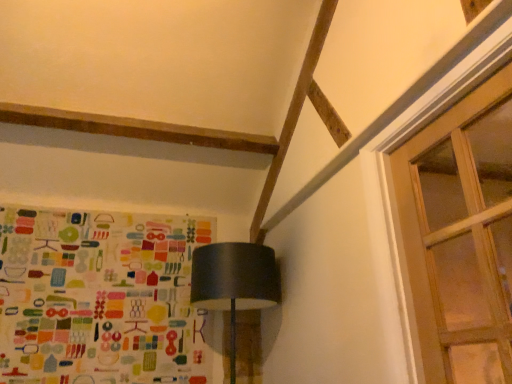
Question: From the image's perspective, would you say clear glass door at upper right is shown under matte black lampshade at center?

Choices:
 (A) no
 (B) yes

Answer: (A)

Question: From the image's perspective, is clear glass door at upper right above matte black lampshade at center?

Choices:
 (A) no
 (B) yes

Answer: (B)

Question: Does clear glass door at upper right come in front of matte black lampshade at center?

Choices:
 (A) yes
 (B) no

Answer: (A)

Question: Could you tell me if clear glass door at upper right is turned towards matte black lampshade at center?

Choices:
 (A) yes
 (B) no

Answer: (B)

Question: Can you confirm if clear glass door at upper right is bigger than matte black lampshade at center?

Choices:
 (A) no
 (B) yes

Answer: (A)

Question: Is clear glass door at upper right far from matte black lampshade at center?

Choices:
 (A) yes
 (B) no

Answer: (A)

Question: Does multicolored fabric at left have a greater height compared to matte black lampshade at center?

Choices:
 (A) no
 (B) yes

Answer: (B)

Question: Is multicolored fabric at left positioned with its back to matte black lampshade at center?

Choices:
 (A) no
 (B) yes

Answer: (A)

Question: From a real-world perspective, is multicolored fabric at left located higher than matte black lampshade at center?

Choices:
 (A) yes
 (B) no

Answer: (A)

Question: From the image's perspective, is multicolored fabric at left located above matte black lampshade at center?

Choices:
 (A) yes
 (B) no

Answer: (A)

Question: Is multicolored fabric at left wider than matte black lampshade at center?

Choices:
 (A) no
 (B) yes

Answer: (A)

Question: Does multicolored fabric at left lie behind matte black lampshade at center?

Choices:
 (A) yes
 (B) no

Answer: (A)

Question: Is the position of matte black lampshade at center more distant than that of clear glass door at upper right?

Choices:
 (A) no
 (B) yes

Answer: (B)